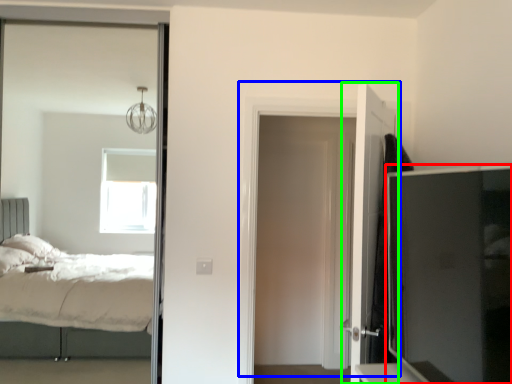
Question: Which is farther away from tv cabinet (highlighted by a red box)? door (highlighted by a blue box) or door (highlighted by a green box)?

Choices:
 (A) door
 (B) door

Answer: (A)